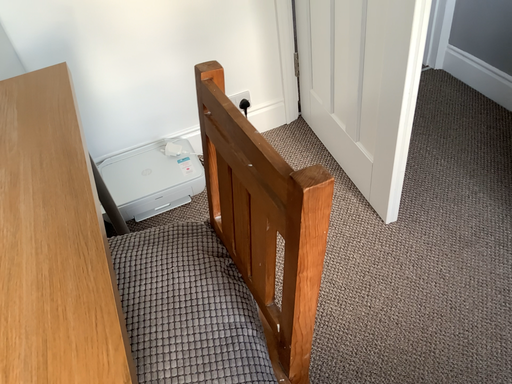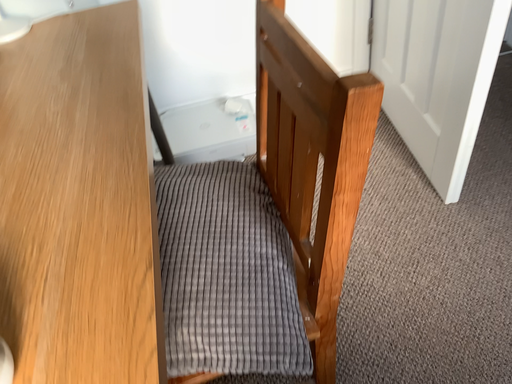
Question: Which way did the camera rotate in the video?

Choices:
 (A) rotated left
 (B) rotated right

Answer: (A)